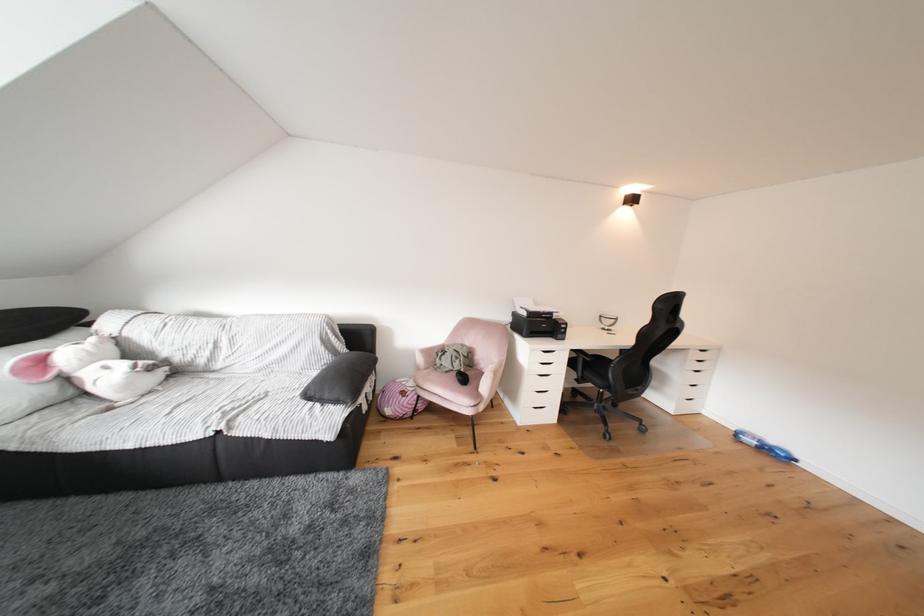
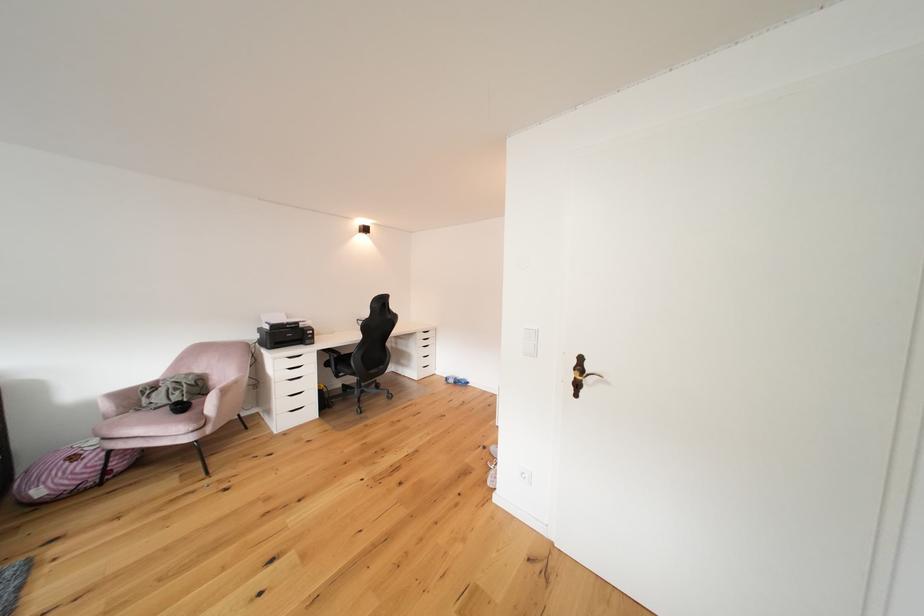
Locate, in the second image, the point that corresponds to [747,438] in the first image.

(456, 383)